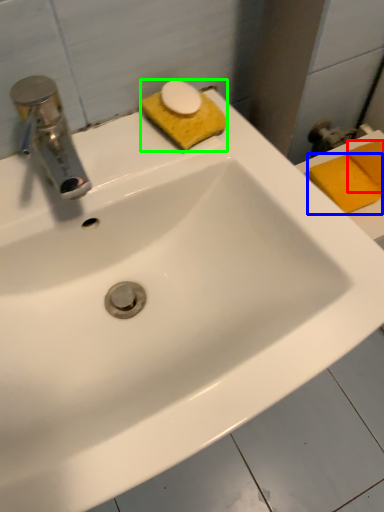
Question: Which object is positioned closest to soap (highlighted by a red box)? Select from soap (highlighted by a blue box) and soap (highlighted by a green box).

Choices:
 (A) soap
 (B) soap

Answer: (A)